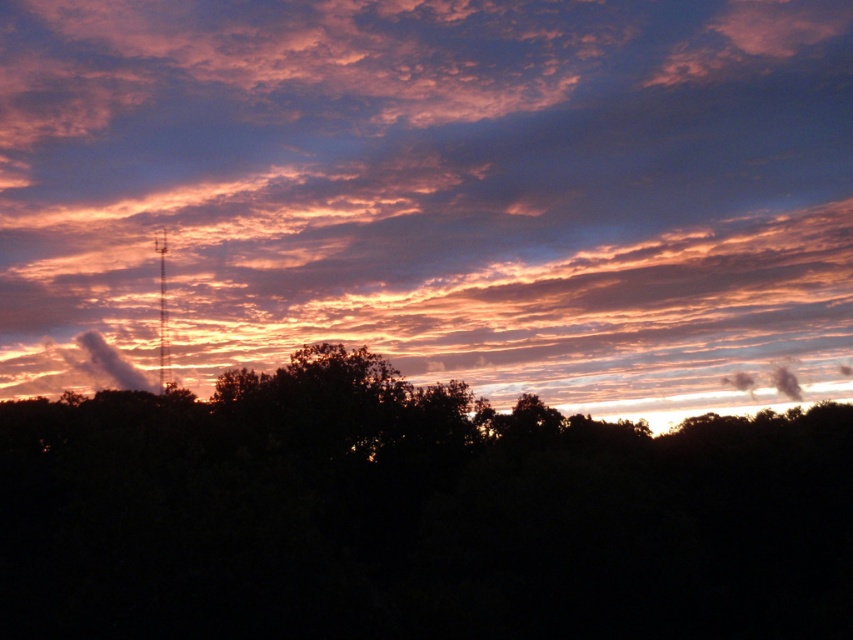
Looking at the sunset scene, which object occupies more space in the image between the cloudy sky at upper center and the dark green leafy tree at center?

The cloudy sky at upper center is larger in size than the dark green leafy tree at center, so it occupies more space in the image.

You are an artist trying to paint the sunset scene. You notice the cloudy sky at upper center and the dark green leafy tree at center. Which object would you need to paint first if you want to paint the background before the foreground?

You should paint the cloudy sky at upper center first because it is the background and the dark green leafy tree at center is in the foreground.

You are standing in the forest looking towards the sunset. You see the cloudy sky at upper center and the dark green leafy tree at center. Which object is closer to you?

The dark green leafy tree at center is closer to you because the cloudy sky at upper center is further away.